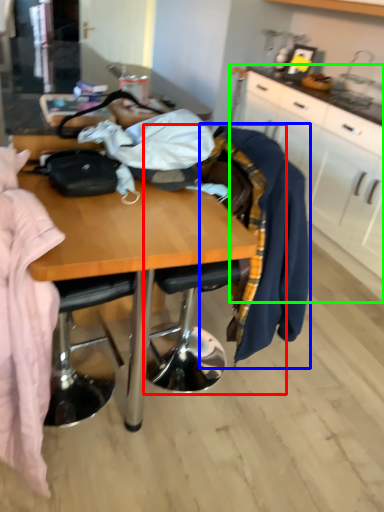
Question: Which object is the closest to the chair (highlighted by a red box)? Choose among these: clothing (highlighted by a blue box) or cabinetry (highlighted by a green box).

Choices:
 (A) clothing
 (B) cabinetry

Answer: (A)